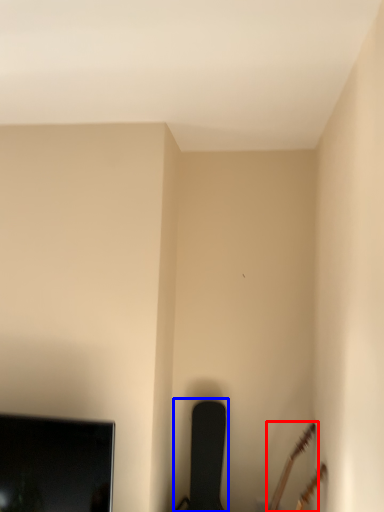
Question: Which point is closer to the camera, guitar (highlighted by a red box) or chair (highlighted by a blue box)?

Choices:
 (A) guitar
 (B) chair

Answer: (A)